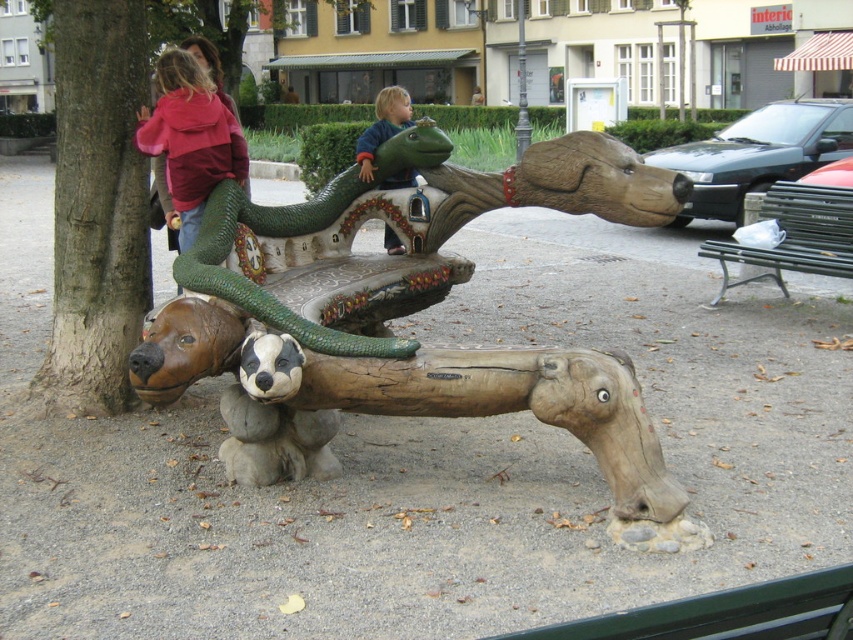
Is brown rough bark at lower left taller than green matte snake at center?

Incorrect, brown rough bark at lower left's height is not larger of green matte snake at center's.

Is point (73, 301) in front of point (300, 227)?

Yes, point (73, 301) is in front of point (300, 227).

Where is `brown rough bark at lower left`? brown rough bark at lower left is located at coordinates (96, 205).

Is brown rough bark at lower left bigger than matte pink hoodie at upper left?

Incorrect, brown rough bark at lower left is not larger than matte pink hoodie at upper left.

Between brown rough bark at lower left and matte pink hoodie at upper left, which one appears on the left side from the viewer's perspective?

brown rough bark at lower left is more to the left.

Where is `brown rough bark at lower left`? The width and height of the screenshot is (853, 640). brown rough bark at lower left is located at coordinates (96, 205).

This screenshot has height=640, width=853. Find the location of `brown rough bark at lower left`. brown rough bark at lower left is located at coordinates (96, 205).

From the picture: Measure the distance between matte pink hoodie at upper left and metallic silver bench at right.

3.72 meters

The width and height of the screenshot is (853, 640). I want to click on matte pink hoodie at upper left, so click(x=190, y=138).

Where is `matte pink hoodie at upper left`? This screenshot has width=853, height=640. matte pink hoodie at upper left is located at coordinates (190, 138).